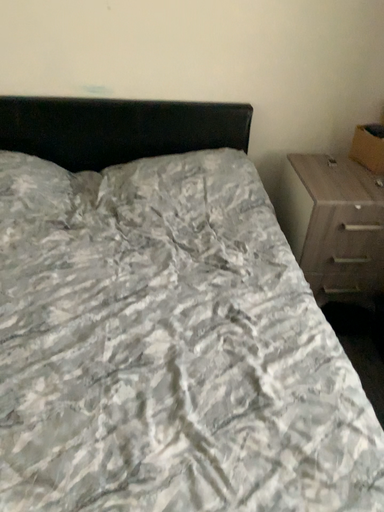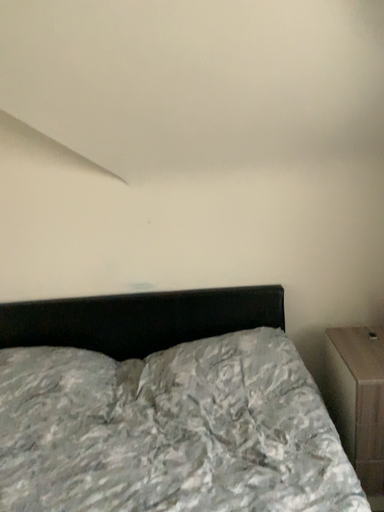
Question: How did the camera likely rotate when shooting the video?

Choices:
 (A) rotated downward
 (B) rotated upward

Answer: (B)